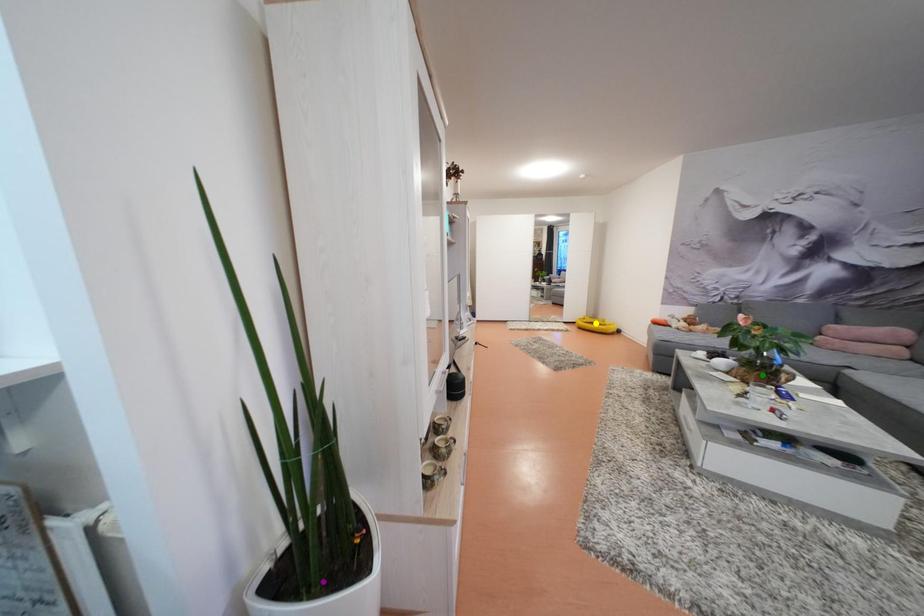
Order these from nearest to farthest:
yellow point | purple point | green point

yellow point, green point, purple point